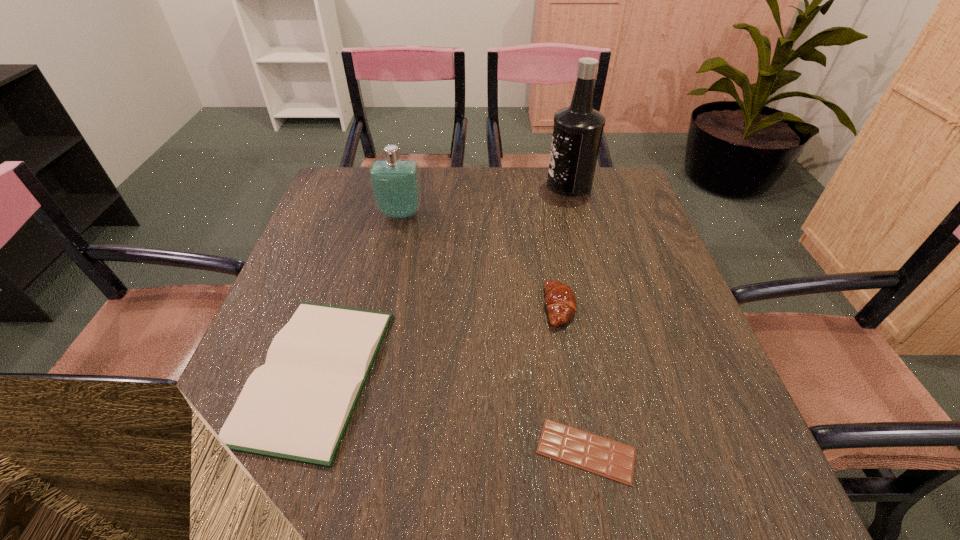
Locate an element on the screen. This screenshot has width=960, height=540. free space between the liquor and the second farthest object is located at coordinates (485, 199).

Find the location of `vacant area between the chocolate bar and the hardback book`. vacant area between the chocolate bar and the hardback book is located at coordinates coord(450,412).

I want to click on vacant area that lies between the chocolate bar and the perfume, so click(x=493, y=333).

Where is `free spot between the crescent roll and the liquor`? The height and width of the screenshot is (540, 960). free spot between the crescent roll and the liquor is located at coordinates (564, 246).

In order to click on free spot between the crescent roll and the hardback book in this screenshot , I will do pos(437,340).

Where is `vacant space that's between the third shortest object and the second shortest object`? vacant space that's between the third shortest object and the second shortest object is located at coordinates (437, 340).

Where is `free area in between the fourth tallest object and the second tallest object`? free area in between the fourth tallest object and the second tallest object is located at coordinates (357, 294).

Point out which object is positioned as the fourth nearest to the crescent roll. Please provide its 2D coordinates. Your answer should be formatted as a tuple, i.e. [(x, y)], where the tuple contains the x and y coordinates of a point satisfying the conditions above.

[(395, 183)]

Point out which object is positioned as the fourth nearest to the hardback book. Please provide its 2D coordinates. Your answer should be formatted as a tuple, i.e. [(x, y)], where the tuple contains the x and y coordinates of a point satisfying the conditions above.

[(577, 132)]

I want to click on free space that satisfies the following two spatial constraints: 1. on the front label of the fourth nearest object; 2. on the right side of the chocolate bar, so click(348, 451).